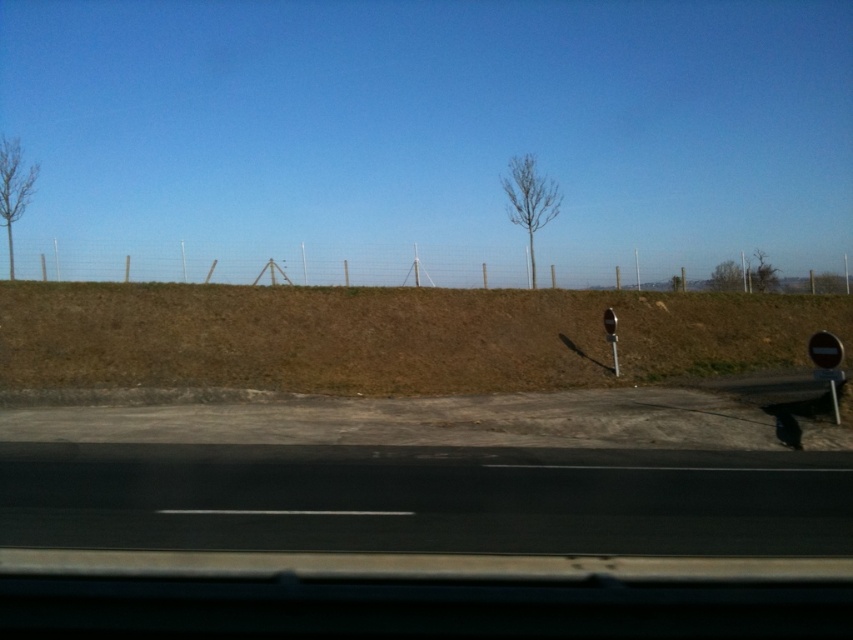
How distant is bare branches at left from green leafy tree at center?

bare branches at left is 114.76 feet away from green leafy tree at center.

Which of these two, bare branches at left or green leafy tree at center, stands taller?

With more height is bare branches at left.

This screenshot has height=640, width=853. I want to click on bare branches at left, so 13,188.

The image size is (853, 640). In order to click on bare branches at left in this screenshot , I will do `click(13, 188)`.

Which is more to the left, black asphalt highway at lower center or bare branches at left?

bare branches at left

Who is taller, black asphalt highway at lower center or bare branches at left?

bare branches at left

Between point (502, 516) and point (1, 156), which one is positioned behind?

Point (1, 156)

This screenshot has width=853, height=640. Identify the location of black asphalt highway at lower center. (424, 499).

In the scene shown: Between black asphalt highway at lower center and bare wood tree at center, which one is positioned higher?

Positioned higher is bare wood tree at center.

Does black asphalt highway at lower center have a smaller size compared to bare wood tree at center?

Yes, black asphalt highway at lower center is smaller than bare wood tree at center.

The height and width of the screenshot is (640, 853). I want to click on black asphalt highway at lower center, so click(424, 499).